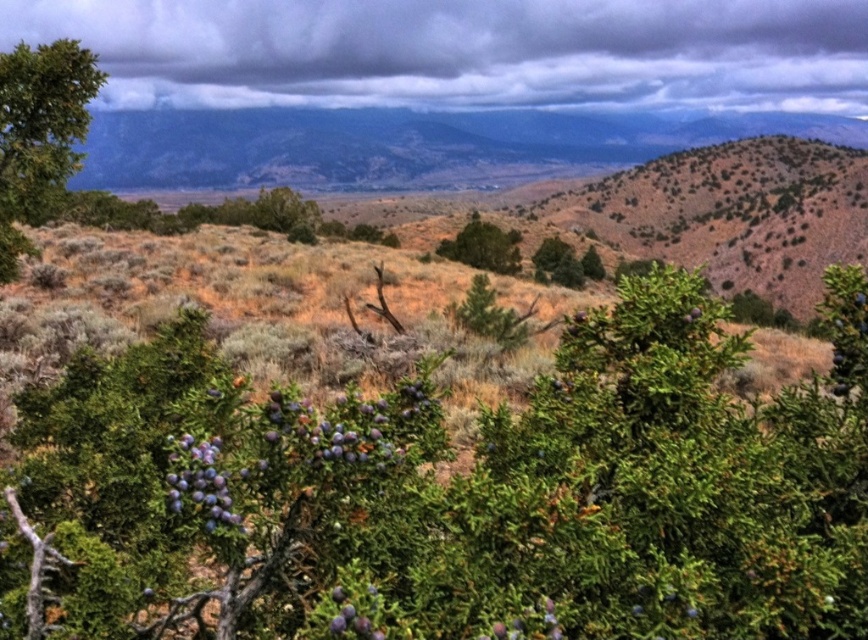
Question: Based on their relative distances, which object is farther from the green matte tree at upper left?

Choices:
 (A) green textured bush at center
 (B) blue matte berries at lower left
 (C) cloudy sky at upper center

Answer: (C)

Question: Can you confirm if cloudy sky at upper center is smaller than blue matte berries at lower left?

Choices:
 (A) yes
 (B) no

Answer: (B)

Question: Among these objects, which one is farthest from the camera?

Choices:
 (A) blueberry-like at right
 (B) purple matte berries at center
 (C) green textured bush at center

Answer: (C)

Question: Estimate the real-world distances between objects in this image. Which object is closer to the purple matte berries at center?

Choices:
 (A) blueberry-like at right
 (B) green textured bush at center
 (C) green matte tree at upper left
 (D) blue matte berries at lower left

Answer: (D)

Question: Does blue matte berries at lower left appear on the right side of green textured bush at center?

Choices:
 (A) yes
 (B) no

Answer: (B)

Question: From the image, what is the correct spatial relationship of cloudy sky at upper center in relation to green matte tree at upper left?

Choices:
 (A) left
 (B) right

Answer: (B)